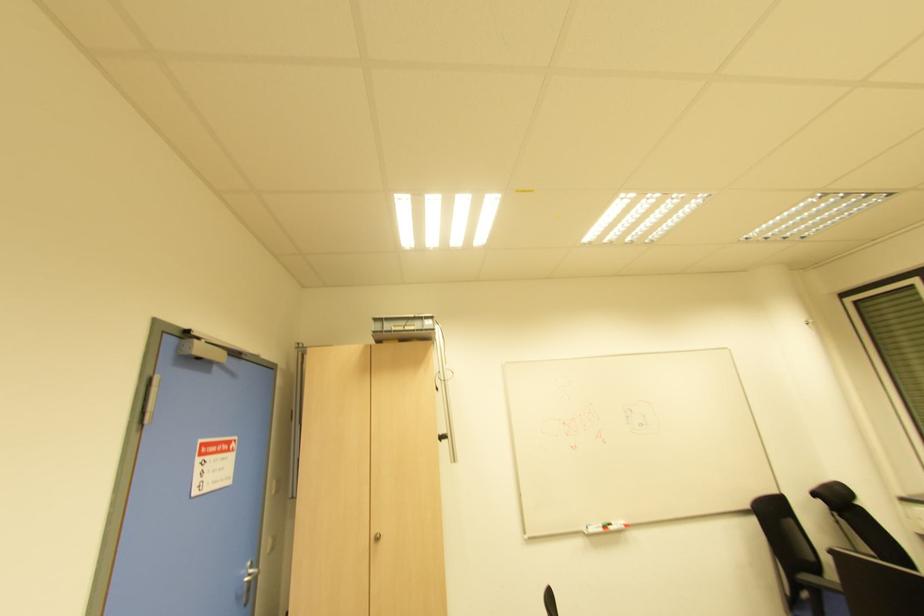
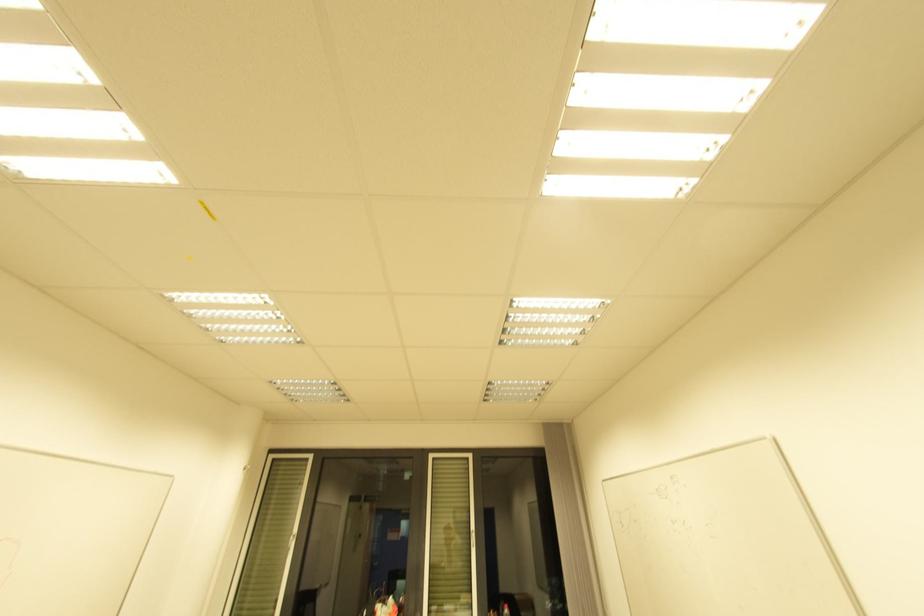
Based on the continuous images, in which direction is the camera rotating?

The rotation direction of the camera is right-up.